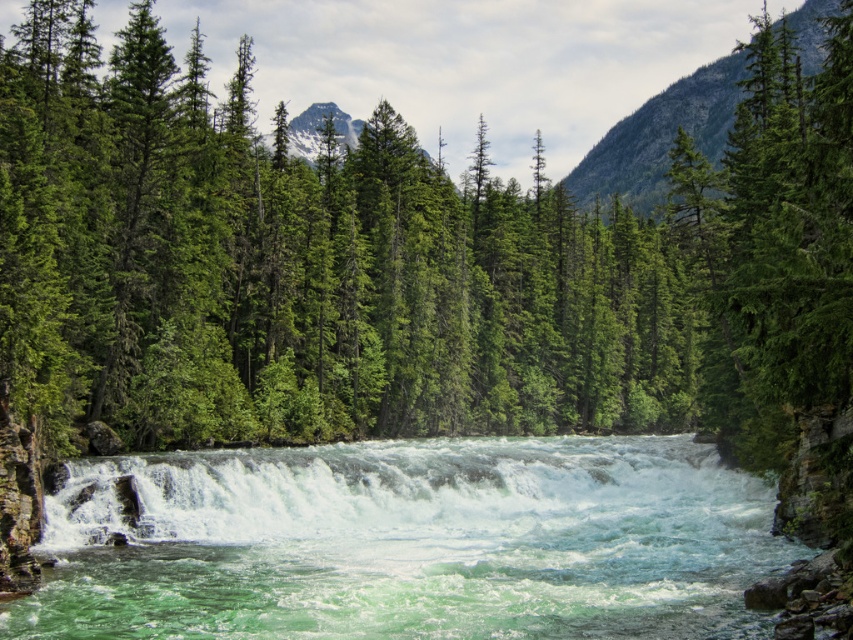
Question: Is green matte tree at center to the left of translucent white water at center from the viewer's perspective?

Choices:
 (A) yes
 (B) no

Answer: (B)

Question: Which object is closer to the camera taking this photo?

Choices:
 (A) translucent white water at center
 (B) green matte tree at center

Answer: (B)

Question: Is green matte tree at center smaller than translucent white water at center?

Choices:
 (A) no
 (B) yes

Answer: (A)

Question: Among these objects, which one is farthest from the camera?

Choices:
 (A) green matte tree at center
 (B) translucent white water at center

Answer: (B)

Question: Can you confirm if green matte tree at center is smaller than translucent white water at center?

Choices:
 (A) yes
 (B) no

Answer: (B)